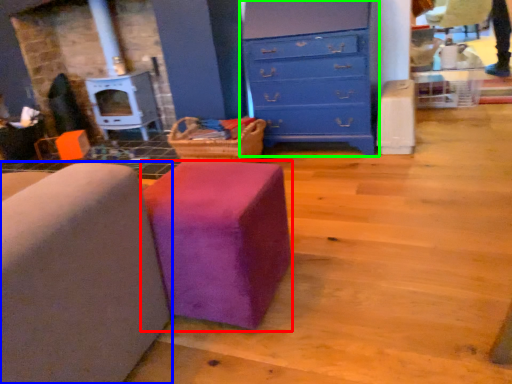
Question: Which object is positioned closest to furniture (highlighted by a red box)? Select from furniture (highlighted by a blue box) and chest of drawers (highlighted by a green box).

Choices:
 (A) furniture
 (B) chest of drawers

Answer: (A)